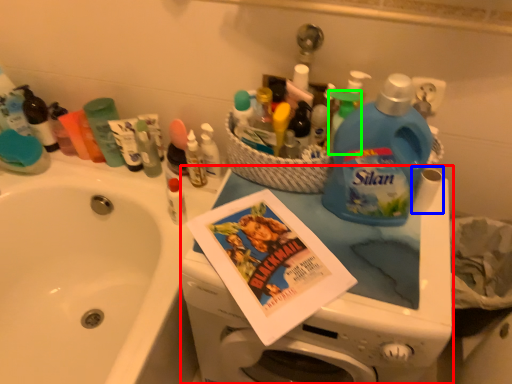
Question: Based on their relative distances, which object is farther from appliance (highlighted by a red box)? Choose from toilet paper (highlighted by a blue box) and cleaning product (highlighted by a green box).

Choices:
 (A) toilet paper
 (B) cleaning product

Answer: (B)